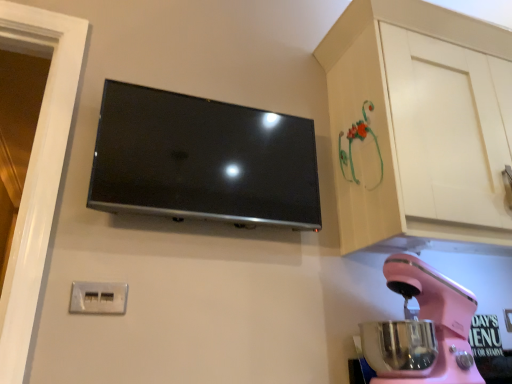
What are the coordinates of `matte white cabinet at upper right` in the screenshot? It's located at (420, 127).

Locate an element on the screen. This screenshot has height=384, width=512. matte black tv at upper center is located at coordinates (203, 160).

Where is `home appliance located in front of the matte black tv at upper center`? home appliance located in front of the matte black tv at upper center is located at coordinates (432, 320).

Is matte black tv at upper center outside of pink plastic stand mixer at lower right?

Yes, matte black tv at upper center is not within pink plastic stand mixer at lower right.

Are matte black tv at upper center and pink plastic stand mixer at lower right far apart?

No, matte black tv at upper center is not far from pink plastic stand mixer at lower right.

Based on the photo, is white plastic electrical outlet at lower left situated inside matte white cabinet at upper right or outside?

white plastic electrical outlet at lower left is located beyond the bounds of matte white cabinet at upper right.

Who is shorter, white plastic electrical outlet at lower left or matte white cabinet at upper right?

With less height is white plastic electrical outlet at lower left.

Which is more to the left, white plastic electrical outlet at lower left or matte white cabinet at upper right?

Positioned to the left is white plastic electrical outlet at lower left.

From the image's perspective, which object appears higher, white plastic electrical outlet at lower left or matte white cabinet at upper right?

From the image's view, matte white cabinet at upper right is above.

From the image's perspective, between matte white cabinet at upper right and white plastic electrical outlet at lower left, who is located below?

From the image's view, white plastic electrical outlet at lower left is below.

Looking at their sizes, would you say matte white cabinet at upper right is wider or thinner than white plastic electrical outlet at lower left?

Considering their sizes, matte white cabinet at upper right looks broader than white plastic electrical outlet at lower left.

In the image, is matte white cabinet at upper right positioned in front of or behind white plastic electrical outlet at lower left?

Clearly, matte white cabinet at upper right is in front of white plastic electrical outlet at lower left.

From a real-world perspective, which is physically above, white plastic electrical outlet at lower left or matte black tv at upper center?

matte black tv at upper center.

Does point (87, 288) lie behind point (108, 87)?

No.

I want to click on electric outlet in front of the matte black tv at upper center, so click(x=98, y=298).

Is white plastic electrical outlet at lower left not close to matte black tv at upper center?

No, white plastic electrical outlet at lower left is not far from matte black tv at upper center.

From their relative heights in the image, would you say pink plastic stand mixer at lower right is taller or shorter than white plastic electrical outlet at lower left?

Clearly, pink plastic stand mixer at lower right is taller compared to white plastic electrical outlet at lower left.

Is pink plastic stand mixer at lower right smaller than white plastic electrical outlet at lower left?

No.

Considering the positions of point (435, 377) and point (104, 299), is point (435, 377) closer or farther from the camera than point (104, 299)?

Point (435, 377).

Which is more to the right, matte black tv at upper center or matte white cabinet at upper right?

matte white cabinet at upper right is more to the right.

How different are the orientations of matte black tv at upper center and matte white cabinet at upper right in degrees?

0.00268 degrees separate the facing orientations of matte black tv at upper center and matte white cabinet at upper right.

From a real-world perspective, does matte black tv at upper center sit lower than matte white cabinet at upper right?

Indeed, from a real-world perspective, matte black tv at upper center is positioned beneath matte white cabinet at upper right.

Considering the positions of objects matte white cabinet at upper right and pink plastic stand mixer at lower right in the image provided, who is in front, matte white cabinet at upper right or pink plastic stand mixer at lower right?

pink plastic stand mixer at lower right is closer to the camera.

Is point (507, 135) positioned before point (455, 371)?

No, it is not.

From the picture: How many degrees apart are the facing directions of matte white cabinet at upper right and pink plastic stand mixer at lower right?

There is a 90-degree angle between the facing directions of matte white cabinet at upper right and pink plastic stand mixer at lower right.

From the image's perspective, is matte white cabinet at upper right located above or below pink plastic stand mixer at lower right?

Clearly, from the image's perspective, matte white cabinet at upper right is above pink plastic stand mixer at lower right.

Locate an element on the screen. The image size is (512, 384). television above the pink plastic stand mixer at lower right (from a real-world perspective) is located at coordinates (203, 160).

At what (x,y) coordinates should I click in order to perform the action: click on cabinetry in front of the white plastic electrical outlet at lower left. Please return your answer as a coordinate pair (x, y). Looking at the image, I should click on (420, 127).

Based on the photo, looking at the image, which one is located closer to matte white cabinet at upper right, pink plastic stand mixer at lower right or white plastic electrical outlet at lower left?

pink plastic stand mixer at lower right.

Considering their positions, is matte white cabinet at upper right positioned further to matte black tv at upper center than white plastic electrical outlet at lower left?

The object further to matte black tv at upper center is white plastic electrical outlet at lower left.

When comparing their distances from pink plastic stand mixer at lower right, does matte black tv at upper center or matte white cabinet at upper right seem closer?

matte white cabinet at upper right.

Considering their positions, is matte white cabinet at upper right positioned further to pink plastic stand mixer at lower right than matte black tv at upper center?

The object further to pink plastic stand mixer at lower right is matte black tv at upper center.

Based on their spatial positions, is matte white cabinet at upper right or pink plastic stand mixer at lower right further from white plastic electrical outlet at lower left?

The object further to white plastic electrical outlet at lower left is matte white cabinet at upper right.

From the picture: Estimate the real-world distances between objects in this image. Which object is further from matte white cabinet at upper right, white plastic electrical outlet at lower left or matte black tv at upper center?

Among the two, white plastic electrical outlet at lower left is located further to matte white cabinet at upper right.

Based on their spatial positions, is white plastic electrical outlet at lower left or matte white cabinet at upper right closer to pink plastic stand mixer at lower right?

matte white cabinet at upper right is positioned closer to the anchor pink plastic stand mixer at lower right.

Considering their positions, is pink plastic stand mixer at lower right positioned closer to matte black tv at upper center than white plastic electrical outlet at lower left?

Among the two, white plastic electrical outlet at lower left is located nearer to matte black tv at upper center.

Identify the location of home appliance located between white plastic electrical outlet at lower left and matte white cabinet at upper right in the left-right direction. (432, 320).

Image resolution: width=512 pixels, height=384 pixels. I want to click on home appliance between matte black tv at upper center and matte white cabinet at upper right in the horizontal direction, so click(432, 320).

Identify the location of television situated between white plastic electrical outlet at lower left and matte white cabinet at upper right from left to right. The image size is (512, 384). (203, 160).

You are a GUI agent. You are given a task and a screenshot of the screen. Output one action in this format:
    pyautogui.click(x=<x>, y=<y>)
    Task: Click on the television between white plastic electrical outlet at lower left and pink plastic stand mixer at lower right
    This screenshot has width=512, height=384.
    Given the screenshot: What is the action you would take?
    pyautogui.click(x=203, y=160)